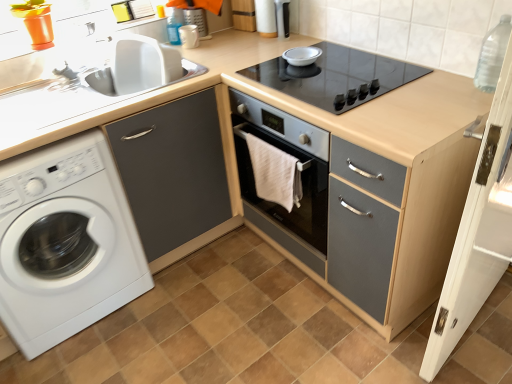
Identify the location of empty space that is in between matte white mug at upper center, marked as the 1th appliance in a left-to-right arrangement, and metallic silver toaster at upper center, the first appliance viewed from the right. (233, 46).